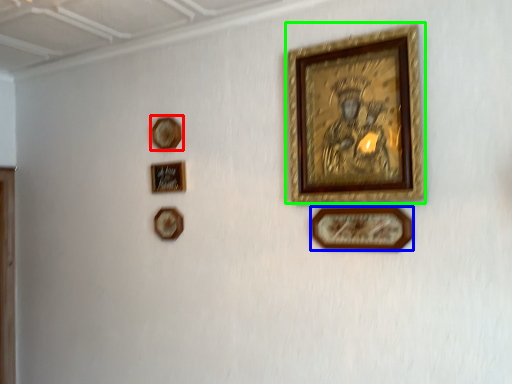
Question: Considering the real-world distances, which object is closest to picture frame (highlighted by a red box)? picture frame (highlighted by a blue box) or picture frame (highlighted by a green box).

Choices:
 (A) picture frame
 (B) picture frame

Answer: (B)